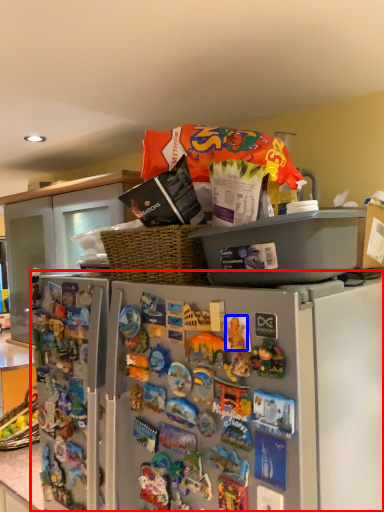
Question: Which point is further to the camera, refrigerator (highlighted by a red box) or toy (highlighted by a blue box)?

Choices:
 (A) refrigerator
 (B) toy

Answer: (A)